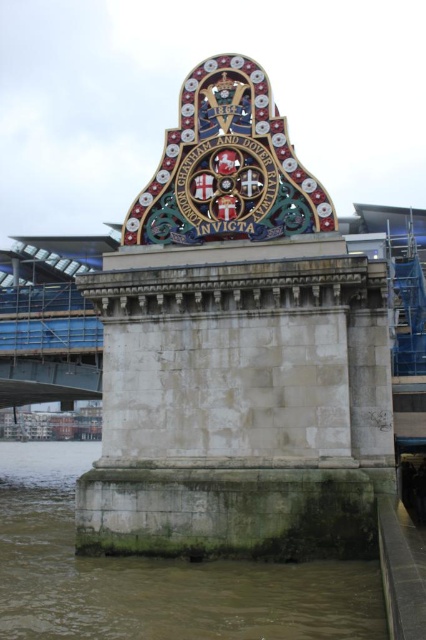
Does brown stone river at lower left have a lesser height compared to multicolored mosaic crest at center?

Indeed, brown stone river at lower left has a lesser height compared to multicolored mosaic crest at center.

Does brown stone river at lower left have a greater width compared to multicolored mosaic crest at center?

Yes.

Image resolution: width=426 pixels, height=640 pixels. In order to click on brown stone river at lower left in this screenshot , I will do `click(154, 576)`.

The width and height of the screenshot is (426, 640). In order to click on multicolored mosaic crest at center in this screenshot , I will do `click(227, 168)`.

Does multicolored mosaic crest at center have a smaller size compared to shiny metallic crest at center?

No, multicolored mosaic crest at center is not smaller than shiny metallic crest at center.

The image size is (426, 640). Identify the location of multicolored mosaic crest at center. (227, 168).

Which is in front, point (115, 632) or point (238, 145)?

Positioned in front is point (115, 632).

Is point (216, 566) farther from camera compared to point (233, 134)?

No, it is in front of (233, 134).

This screenshot has width=426, height=640. In order to click on brown stone river at lower left in this screenshot , I will do `click(154, 576)`.